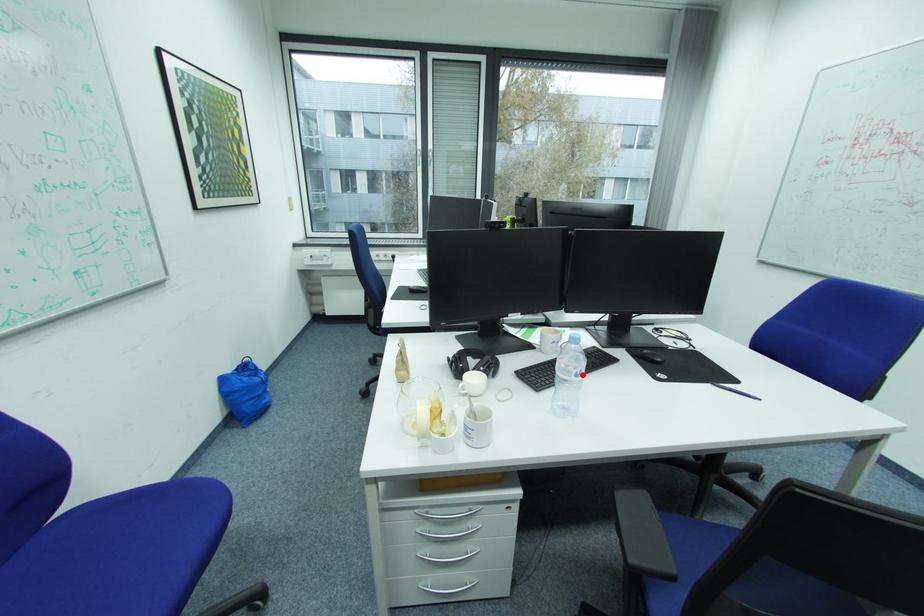
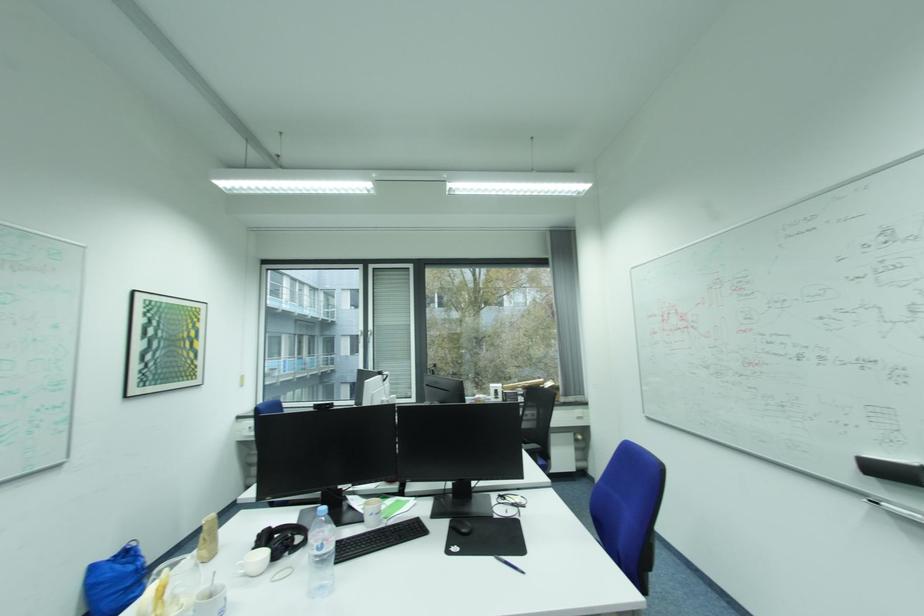
In the second image, find the point that corresponds to the highlighted location in the first image.

(323, 549)